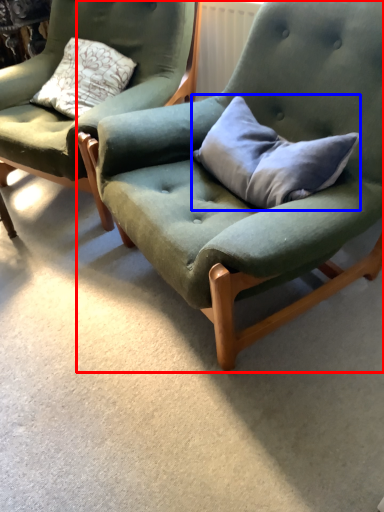
Question: Which point is further to the camera, chair (highlighted by a red box) or pillow (highlighted by a blue box)?

Choices:
 (A) chair
 (B) pillow

Answer: (B)